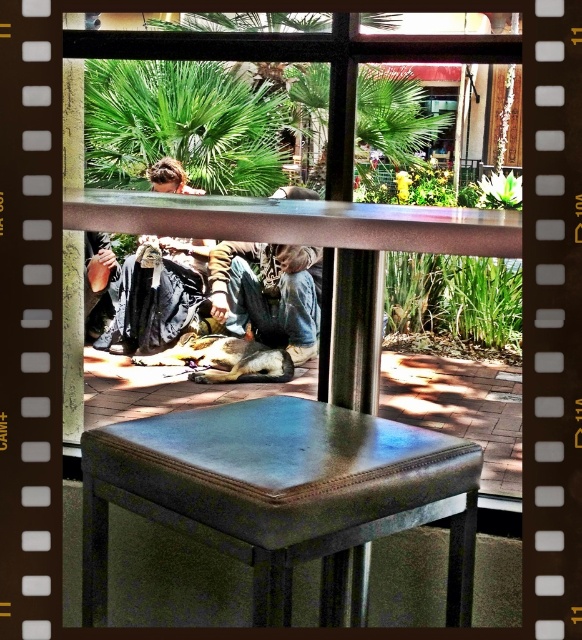
Does green leafy palm tree at upper center appear over dark gray fabric at lower left?

Indeed, green leafy palm tree at upper center is positioned over dark gray fabric at lower left.

Where is `green leafy palm tree at upper center`? green leafy palm tree at upper center is located at coordinates (182, 125).

Where is `green leafy palm tree at upper center`? The height and width of the screenshot is (640, 582). green leafy palm tree at upper center is located at coordinates (182, 125).

Can you confirm if leather-like stool at center is positioned below dark gray fabric at lower left?

Indeed, leather-like stool at center is positioned under dark gray fabric at lower left.

Based on the photo, does leather-like stool at center have a greater height compared to dark gray fabric at lower left?

In fact, leather-like stool at center may be shorter than dark gray fabric at lower left.

You are a GUI agent. You are given a task and a screenshot of the screen. Output one action in this format:
    pyautogui.click(x=<x>, y=<y>)
    Task: Click on the leather-like stool at center
    The image size is (582, 640).
    Given the screenshot: What is the action you would take?
    pyautogui.click(x=282, y=497)

Is denim jeans at center positioned in front of dark gray fabric at lower left?

Yes.

From the picture: Is denim jeans at center above dark gray fabric at lower left?

Actually, denim jeans at center is below dark gray fabric at lower left.

Does point (225, 292) come farther from viewer compared to point (134, 328)?

No, it is not.

Where is `denim jeans at center`? The width and height of the screenshot is (582, 640). denim jeans at center is located at coordinates (268, 291).